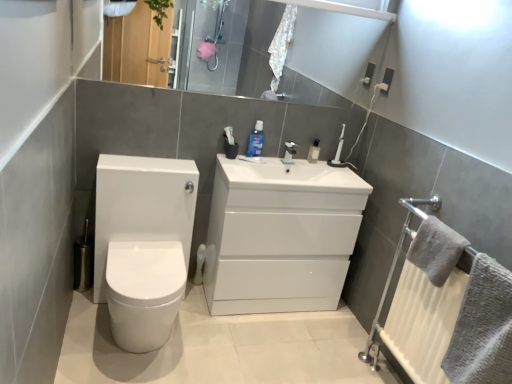
Question: Is gray textured towel at right, acting as the 2th bath towel starting from the top, beside gray fluffy towel at right, placed as the second bath towel when sorted from bottom to top?

Choices:
 (A) yes
 (B) no

Answer: (B)

Question: From a real-world perspective, is gray textured towel at right, acting as the first bath towel starting from the bottom, located higher than gray fluffy towel at right, placed as the second bath towel when sorted from bottom to top?

Choices:
 (A) yes
 (B) no

Answer: (B)

Question: Can you confirm if gray textured towel at right, acting as the first bath towel starting from the bottom, is wider than gray fluffy towel at right, placed as the second bath towel when sorted from bottom to top?

Choices:
 (A) no
 (B) yes

Answer: (B)

Question: Is gray textured towel at right, acting as the first bath towel starting from the bottom, bigger than gray fluffy towel at right, the 1th bath towel positioned from the top?

Choices:
 (A) yes
 (B) no

Answer: (A)

Question: Does gray textured towel at right, acting as the 2th bath towel starting from the top, appear on the right side of gray fluffy towel at right, placed as the second bath towel when sorted from bottom to top?

Choices:
 (A) yes
 (B) no

Answer: (A)

Question: Is gray textured towel at right, acting as the 2th bath towel starting from the top, smaller than gray fluffy towel at right, placed as the second bath towel when sorted from bottom to top?

Choices:
 (A) no
 (B) yes

Answer: (A)

Question: Can you confirm if blue glossy mouthwash at center, marked as the 1th mouthwash in a left-to-right arrangement, is thinner than white glossy toilet at left?

Choices:
 (A) no
 (B) yes

Answer: (B)

Question: From a real-world perspective, is blue glossy mouthwash at center, which is counted as the second mouthwash, starting from the right, located higher than white glossy toilet at left?

Choices:
 (A) no
 (B) yes

Answer: (B)

Question: Could you tell me if blue glossy mouthwash at center, which is counted as the second mouthwash, starting from the right, is turned towards white glossy toilet at left?

Choices:
 (A) yes
 (B) no

Answer: (B)

Question: Is blue glossy mouthwash at center, which is counted as the second mouthwash, starting from the right, at the left side of white glossy toilet at left?

Choices:
 (A) yes
 (B) no

Answer: (B)

Question: Is blue glossy mouthwash at center, marked as the 1th mouthwash in a left-to-right arrangement, looking in the opposite direction of white glossy toilet at left?

Choices:
 (A) no
 (B) yes

Answer: (A)

Question: Is blue glossy mouthwash at center, marked as the 1th mouthwash in a left-to-right arrangement, smaller than white glossy toilet at left?

Choices:
 (A) yes
 (B) no

Answer: (A)

Question: Is white glossy toilet at left next to glossy white mirror at upper center?

Choices:
 (A) no
 (B) yes

Answer: (A)